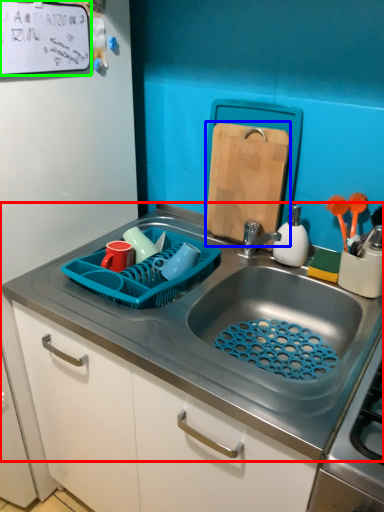
Question: Considering the real-world distances, which object is farthest from sink (highlighted by a red box)? cutting board (highlighted by a blue box) or bulletin board (highlighted by a green box)?

Choices:
 (A) cutting board
 (B) bulletin board

Answer: (B)